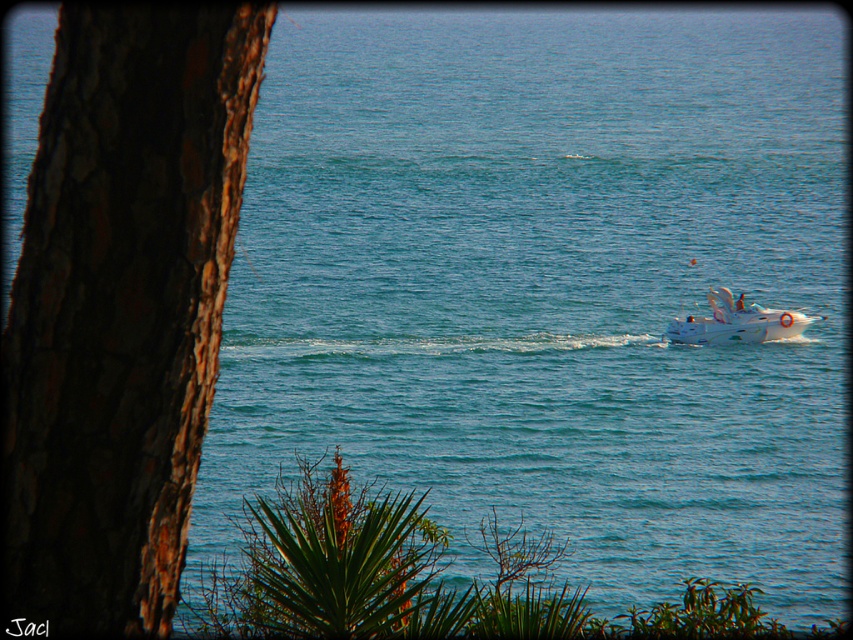
Who is taller, brown rough bark tree at left or white glossy boat at right?

brown rough bark tree at left

Is point (125, 90) less distant than point (727, 289)?

That is True.

What do you see at coordinates (122, 305) in the screenshot?
I see `brown rough bark tree at left` at bounding box center [122, 305].

Locate an element on the screen. The height and width of the screenshot is (640, 853). brown rough bark tree at left is located at coordinates pos(122,305).